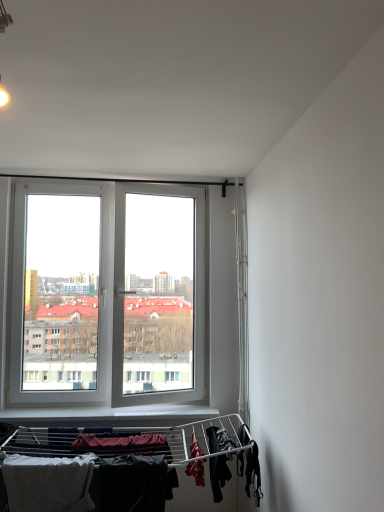
Measure the distance between point (x=58, y=498) and camera.

The depth of point (x=58, y=498) is 6.93 feet.

Describe the element at coordinates (48, 483) in the screenshot. I see `gray cotton towel at lower left, arranged as the first clothing when viewed from the left` at that location.

You are a GUI agent. You are given a task and a screenshot of the screen. Output one action in this format:
    pyautogui.click(x=<x>, y=<y>)
    Task: Click on the gray cotton towel at lower left, arranged as the first clothing when viewed from the left
    The height and width of the screenshot is (512, 384).
    Given the screenshot: What is the action you would take?
    pyautogui.click(x=48, y=483)

Does gray cotton towel at lower left, arranged as the first clothing when viewed from the left, have a greater width compared to dark matte fabric at lower center, which is the 2th clothing from left to right?

Indeed, gray cotton towel at lower left, arranged as the first clothing when viewed from the left, has a greater width compared to dark matte fabric at lower center, which is the 2th clothing from left to right.

Identify the location of clothing that is the 1st object above the gray cotton towel at lower left, arranged as the first clothing when viewed from the left (from a real-world perspective). The width and height of the screenshot is (384, 512). (133, 484).

Is gray cotton towel at lower left, the 3th clothing from the right, positioned with its back to dark matte fabric at lower center, which is the 2th clothing from left to right?

No, gray cotton towel at lower left, the 3th clothing from the right, is not facing the opposite direction of dark matte fabric at lower center, which is the 2th clothing from left to right.

Would you say gray cotton towel at lower left, the 3th clothing from the right, is outside dark matte fabric at lower center, the 2th clothing when ordered from right to left?

Indeed, gray cotton towel at lower left, the 3th clothing from the right, is completely outside dark matte fabric at lower center, the 2th clothing when ordered from right to left.

Does dark matte fabric at lower center, which is the 2th clothing from left to right, lie in front of gray cotton towel at lower left, the 3th clothing from the right?

No, dark matte fabric at lower center, which is the 2th clothing from left to right, is behind gray cotton towel at lower left, the 3th clothing from the right.

Can you confirm if dark matte fabric at lower center, the 2th clothing when ordered from right to left, is positioned to the left of gray cotton towel at lower left, the 3th clothing from the right?

Incorrect, dark matte fabric at lower center, the 2th clothing when ordered from right to left, is not on the left side of gray cotton towel at lower left, the 3th clothing from the right.

Does dark matte fabric at lower center, the 2th clothing when ordered from right to left, have a greater width compared to gray cotton towel at lower left, arranged as the first clothing when viewed from the left?

Incorrect, the width of dark matte fabric at lower center, the 2th clothing when ordered from right to left, does not surpass that of gray cotton towel at lower left, arranged as the first clothing when viewed from the left.

Would you say gray cotton towel at lower left, arranged as the first clothing when viewed from the left, is part of dark matte fabric at lower center, which is the 2th clothing from left to right,'s contents?

Definitely not — gray cotton towel at lower left, arranged as the first clothing when viewed from the left, is not inside dark matte fabric at lower center, which is the 2th clothing from left to right.

From the image's perspective, which one is positioned lower, gray cotton towel at lower left, the 3th clothing from the right, or black fabric at lower right, placed as the third clothing when sorted from left to right?

gray cotton towel at lower left, the 3th clothing from the right, from the image's perspective.

Does gray cotton towel at lower left, the 3th clothing from the right, have a lesser width compared to black fabric at lower right, placed as the third clothing when sorted from left to right?

Yes.

Is the surface of gray cotton towel at lower left, the 3th clothing from the right, in direct contact with black fabric at lower right, which ranks as the 1th clothing in right-to-left order?

They are not placed beside each other.

Which object is closer to the camera taking this photo, black fabric at lower right, which ranks as the 1th clothing in right-to-left order, or gray cotton towel at lower left, arranged as the first clothing when viewed from the left?

gray cotton towel at lower left, arranged as the first clothing when viewed from the left, is closer to the camera.

In terms of size, does black fabric at lower right, placed as the third clothing when sorted from left to right, appear bigger or smaller than gray cotton towel at lower left, the 3th clothing from the right?

Considering their sizes, black fabric at lower right, placed as the third clothing when sorted from left to right, takes up less space than gray cotton towel at lower left, the 3th clothing from the right.

Which of these two, black fabric at lower right, placed as the third clothing when sorted from left to right, or gray cotton towel at lower left, the 3th clothing from the right, stands taller?

gray cotton towel at lower left, the 3th clothing from the right, is taller.

Is black fabric at lower right, placed as the third clothing when sorted from left to right, placed right next to gray cotton towel at lower left, arranged as the first clothing when viewed from the left?

black fabric at lower right, placed as the third clothing when sorted from left to right, is not next to gray cotton towel at lower left, arranged as the first clothing when viewed from the left, and they're not touching.

Can dark matte fabric at lower center, which is the 2th clothing from left to right, be found inside black fabric at lower right, placed as the third clothing when sorted from left to right?

That's incorrect, dark matte fabric at lower center, which is the 2th clothing from left to right, is not inside black fabric at lower right, placed as the third clothing when sorted from left to right.

Based on the photo, is black fabric at lower right, which ranks as the 1th clothing in right-to-left order, facing away from dark matte fabric at lower center, which is the 2th clothing from left to right?

No, black fabric at lower right, which ranks as the 1th clothing in right-to-left order,'s orientation is not away from dark matte fabric at lower center, which is the 2th clothing from left to right.

Which is nearer, (218,450) or (152,481)?

Point (218,450) is closer to the camera than point (152,481).

From a real-world perspective, which object rests below the other?

dark matte fabric at lower center, the 2th clothing when ordered from right to left, from a real-world perspective.

Does dark matte fabric at lower center, the 2th clothing when ordered from right to left, come behind black fabric at lower right, placed as the third clothing when sorted from left to right?

No, dark matte fabric at lower center, the 2th clothing when ordered from right to left, is closer to the viewer.

Can you confirm if dark matte fabric at lower center, which is the 2th clothing from left to right, is smaller than black fabric at lower right, which ranks as the 1th clothing in right-to-left order?

Incorrect, dark matte fabric at lower center, which is the 2th clothing from left to right, is not smaller in size than black fabric at lower right, which ranks as the 1th clothing in right-to-left order.

Is dark matte fabric at lower center, which is the 2th clothing from left to right, facing towards black fabric at lower right, placed as the third clothing when sorted from left to right?

No.

Can you see dark matte fabric at lower center, which is the 2th clothing from left to right, touching black fabric at lower right, placed as the third clothing when sorted from left to right?

No, dark matte fabric at lower center, which is the 2th clothing from left to right, is not in contact with black fabric at lower right, placed as the third clothing when sorted from left to right.

You are a GUI agent. You are given a task and a screenshot of the screen. Output one action in this format:
    pyautogui.click(x=<x>, y=<y>)
    Task: Click on the clothing below the dark matte fabric at lower center, the 2th clothing when ordered from right to left (from the image's perspective)
    The image size is (384, 512).
    Given the screenshot: What is the action you would take?
    pyautogui.click(x=48, y=483)

Identify the location of clothing in front of the dark matte fabric at lower center, which is the 2th clothing from left to right. The image size is (384, 512). (48, 483).

Looking at the image, which one is located further to black fabric at lower right, which ranks as the 1th clothing in right-to-left order, gray cotton towel at lower left, arranged as the first clothing when viewed from the left, or dark matte fabric at lower center, the 2th clothing when ordered from right to left?

Based on the image, gray cotton towel at lower left, arranged as the first clothing when viewed from the left, appears to be further to black fabric at lower right, which ranks as the 1th clothing in right-to-left order.

Which object lies further to the anchor point dark matte fabric at lower center, the 2th clothing when ordered from right to left, black fabric at lower right, which ranks as the 1th clothing in right-to-left order, or gray cotton towel at lower left, the 3th clothing from the right?

black fabric at lower right, which ranks as the 1th clothing in right-to-left order, is positioned further to the anchor dark matte fabric at lower center, the 2th clothing when ordered from right to left.

Looking at the image, which one is located further to gray cotton towel at lower left, the 3th clothing from the right, black fabric at lower right, which ranks as the 1th clothing in right-to-left order, or dark matte fabric at lower center, the 2th clothing when ordered from right to left?

Among the two, black fabric at lower right, which ranks as the 1th clothing in right-to-left order, is located further to gray cotton towel at lower left, the 3th clothing from the right.

From the image, which object appears to be nearer to gray cotton towel at lower left, the 3th clothing from the right, dark matte fabric at lower center, which is the 2th clothing from left to right, or black fabric at lower right, which ranks as the 1th clothing in right-to-left order?

dark matte fabric at lower center, which is the 2th clothing from left to right, is closer to gray cotton towel at lower left, the 3th clothing from the right.

Which object lies nearer to the anchor point dark matte fabric at lower center, the 2th clothing when ordered from right to left, gray cotton towel at lower left, the 3th clothing from the right, or black fabric at lower right, placed as the third clothing when sorted from left to right?

gray cotton towel at lower left, the 3th clothing from the right, is positioned closer to the anchor dark matte fabric at lower center, the 2th clothing when ordered from right to left.

Estimate the real-world distances between objects in this image. Which object is further from black fabric at lower right, placed as the third clothing when sorted from left to right, dark matte fabric at lower center, the 2th clothing when ordered from right to left, or gray cotton towel at lower left, the 3th clothing from the right?

gray cotton towel at lower left, the 3th clothing from the right.

Identify the location of clothing between gray cotton towel at lower left, the 3th clothing from the right, and black fabric at lower right, placed as the third clothing when sorted from left to right, in the horizontal direction. (133, 484).